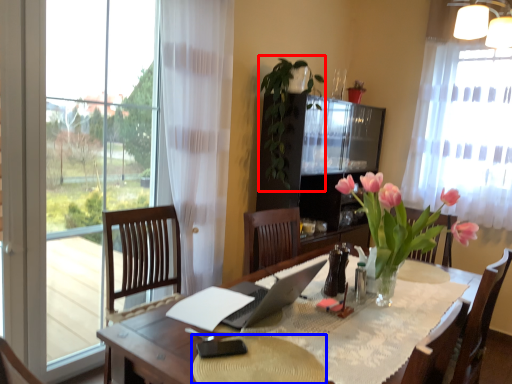
Question: Which point is further to the camera, plant (highlighted by a red box) or flat (highlighted by a blue box)?

Choices:
 (A) plant
 (B) flat

Answer: (A)